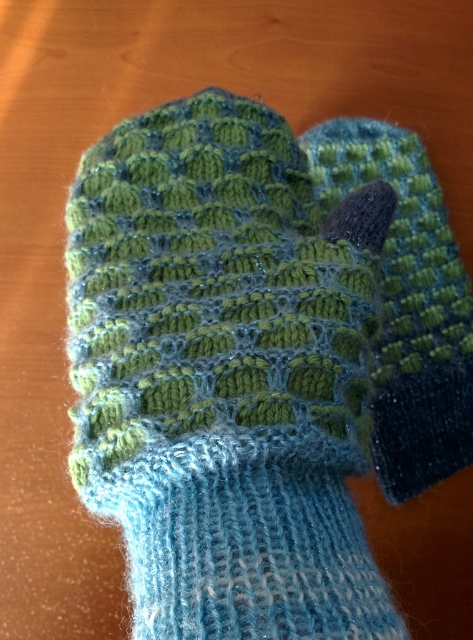
You are packing for a winter trip and have limited space in your bag. You need to choose between the knitted woolen glove at center and the green knitted sock at center to take with you. Based on their sizes, which one should you choose to save more space?

The knitted woolen glove at center is larger in size than the green knitted sock at center, so you should choose the green knitted sock at center to save more space.

You are standing 24 inches away from a wooden table with a knitted woolen glove at center. Can you reach the glove without moving your feet?

The knitted woolen glove at center is 22.26 inches away from the camera, so yes, you can reach it without moving your feet since it is within your 24 inch reach distance.

You are trying to decide which item to use for keeping your hands warm during a cold winter day. You have the knitted woolen glove at center and the green knitted sock at center in front of you. Which item is shorter and thus might be less suitable for covering your entire hand?

The knitted woolen glove at center is shorter than the green knitted sock at center, so it might be less suitable for covering your entire hand.